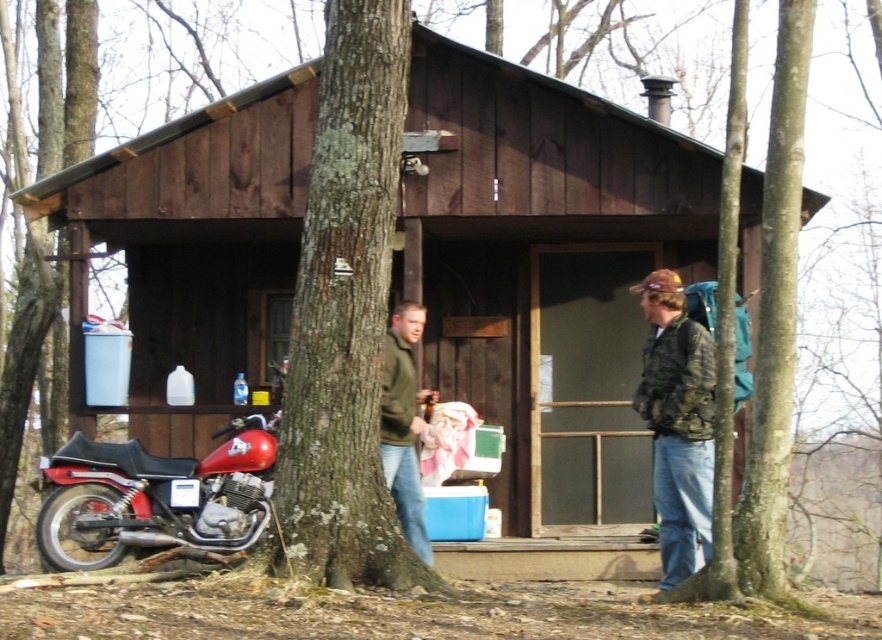
Question: Is smooth bark tree at center in front of shiny red motorcycle at lower left?

Choices:
 (A) yes
 (B) no

Answer: (A)

Question: Considering the real-world distances, which object is closest to the shiny red motorcycle at lower left?

Choices:
 (A) green fuzzy sweater at center
 (B) camouflage jacket at right

Answer: (A)

Question: Does smooth bark tree at center appear on the right side of green fuzzy sweater at center?

Choices:
 (A) no
 (B) yes

Answer: (A)

Question: Among these points, which one is nearest to the camera?

Choices:
 (A) (206, 493)
 (B) (322, 289)
 (C) (692, 522)

Answer: (B)

Question: Which point appears closest to the camera in this image?

Choices:
 (A) (255, 484)
 (B) (660, 333)
 (C) (350, 326)
 (D) (415, 436)

Answer: (C)

Question: Where is smooth bark tree at center located in relation to green fuzzy sweater at center in the image?

Choices:
 (A) right
 (B) left

Answer: (B)